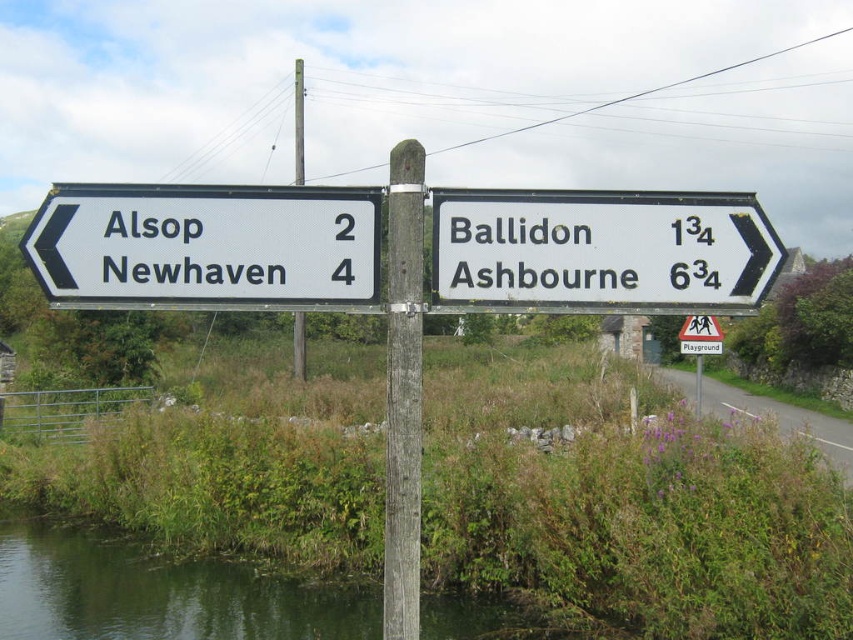
Question: Which object appears closest to the camera in this image?

Choices:
 (A) white plastic sign at left
 (B) white plastic sign at upper right
 (C) brown wooden pole at center
 (D) green grassy river at lower left

Answer: (A)

Question: Does white plastic sign at left appear over green grassy river at lower left?

Choices:
 (A) no
 (B) yes

Answer: (B)

Question: Is green grassy river at lower left closer to camera compared to metallic pole at center?

Choices:
 (A) yes
 (B) no

Answer: (B)

Question: Which point is closer to the camera taking this photo?

Choices:
 (A) (198, 289)
 (B) (297, 113)
 (C) (93, 540)

Answer: (A)

Question: Which is nearer to the white plastic sign at upper right?

Choices:
 (A) white plastic sign at left
 (B) green grassy river at lower left

Answer: (A)

Question: Is brown wooden pole at center positioned at the back of metallic pole at center?

Choices:
 (A) yes
 (B) no

Answer: (A)